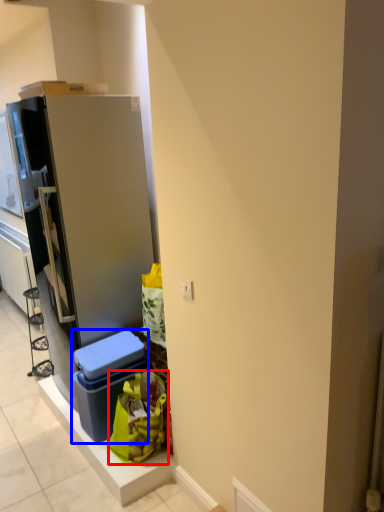
Question: Which point is further to the camera, garbage (highlighted by a red box) or storage box (highlighted by a blue box)?

Choices:
 (A) garbage
 (B) storage box

Answer: (B)